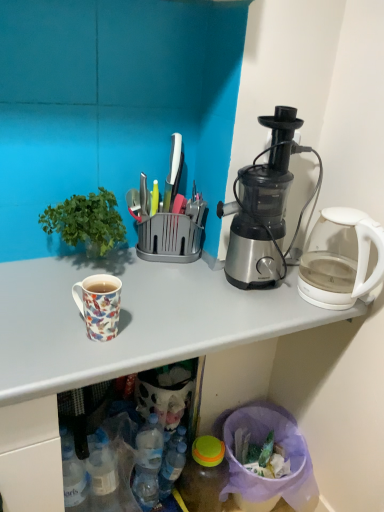
The height and width of the screenshot is (512, 384). Identify the location of vacant area that lies between floral ceramic mug at left and satin silver blender at right. (178, 304).